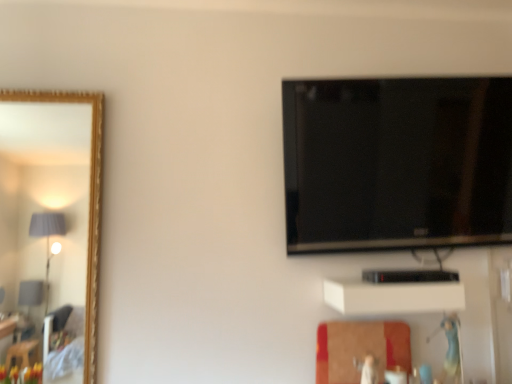
Question: Is black glossy tv at upper right not near white matte cabinet at lower center?

Choices:
 (A) yes
 (B) no

Answer: (B)

Question: Is black glossy tv at upper right thinner than white matte cabinet at lower center?

Choices:
 (A) no
 (B) yes

Answer: (B)

Question: From the image's perspective, is black glossy tv at upper right on top of white matte cabinet at lower center?

Choices:
 (A) no
 (B) yes

Answer: (B)

Question: Is black glossy tv at upper right at the left side of white matte cabinet at lower center?

Choices:
 (A) yes
 (B) no

Answer: (B)

Question: Is the depth of black glossy tv at upper right greater than that of white matte cabinet at lower center?

Choices:
 (A) no
 (B) yes

Answer: (B)

Question: Is black glossy tv at upper right with white matte cabinet at lower center?

Choices:
 (A) yes
 (B) no

Answer: (B)

Question: Is white matte cabinet at lower center at the right side of black glossy tv at upper right?

Choices:
 (A) yes
 (B) no

Answer: (B)

Question: Are white matte cabinet at lower center and black glossy tv at upper right far apart?

Choices:
 (A) yes
 (B) no

Answer: (B)

Question: Is white matte cabinet at lower center looking in the opposite direction of black glossy tv at upper right?

Choices:
 (A) no
 (B) yes

Answer: (A)

Question: Considering the relative positions of white matte cabinet at lower center and black glossy tv at upper right in the image provided, is white matte cabinet at lower center to the left of black glossy tv at upper right from the viewer's perspective?

Choices:
 (A) no
 (B) yes

Answer: (B)

Question: Is the depth of white matte cabinet at lower center greater than that of black glossy tv at upper right?

Choices:
 (A) yes
 (B) no

Answer: (B)

Question: From a real-world perspective, is white matte cabinet at lower center physically above black glossy tv at upper right?

Choices:
 (A) no
 (B) yes

Answer: (A)

Question: Is white matte cabinet at lower center taller or shorter than black glossy tv at upper right?

Choices:
 (A) short
 (B) tall

Answer: (A)